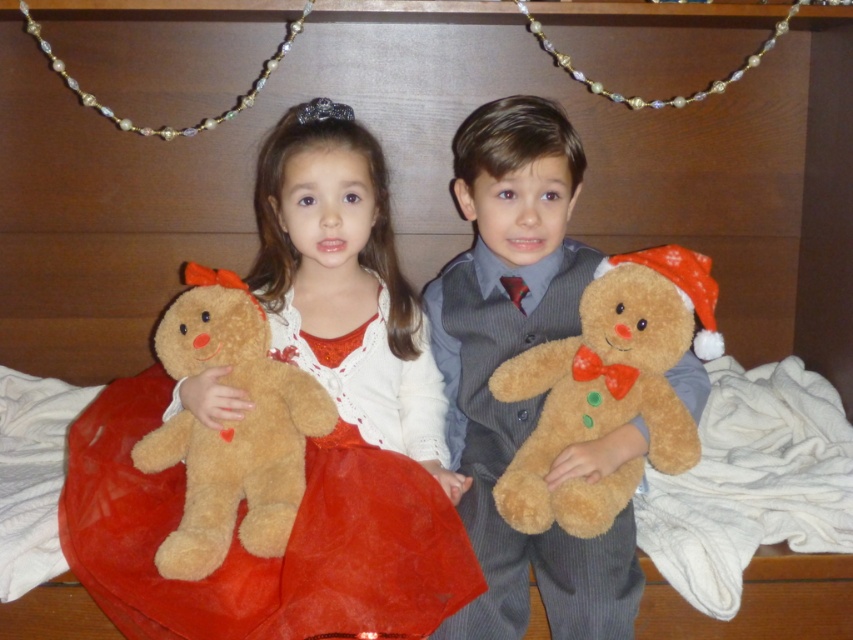
Question: Which point appears closest to the camera in this image?

Choices:
 (A) (207, 320)
 (B) (627, 612)
 (C) (502, 500)

Answer: (B)

Question: Does fuzzy brown teddy bear at center have a smaller size compared to velvety red dress at center?

Choices:
 (A) yes
 (B) no

Answer: (B)

Question: Considering the real-world distances, which object is farthest from the fuzzy brown teddy bear at right?

Choices:
 (A) fuzzy brown teddy bear at center
 (B) velvety red dress at center
 (C) fuzzy brown teddy bear at left

Answer: (C)

Question: Does velvety red dress at center have a larger size compared to fuzzy brown teddy bear at left?

Choices:
 (A) yes
 (B) no

Answer: (A)

Question: From the image, what is the correct spatial relationship of fuzzy brown teddy bear at center in relation to fuzzy brown teddy bear at left?

Choices:
 (A) left
 (B) right

Answer: (B)

Question: Based on their relative distances, which object is nearer to the velvety red dress at center?

Choices:
 (A) fuzzy brown teddy bear at center
 (B) fuzzy brown teddy bear at left
 (C) fuzzy brown teddy bear at right

Answer: (B)